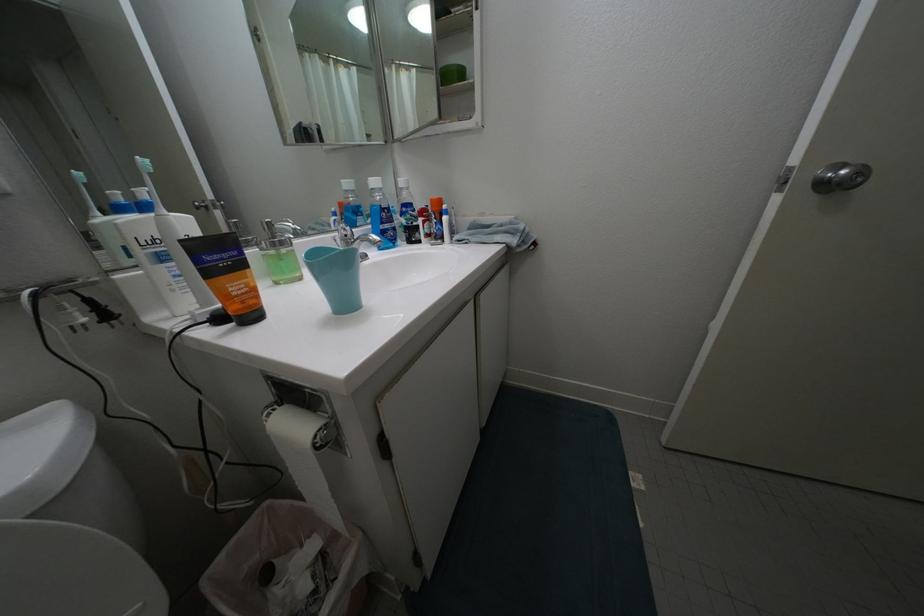
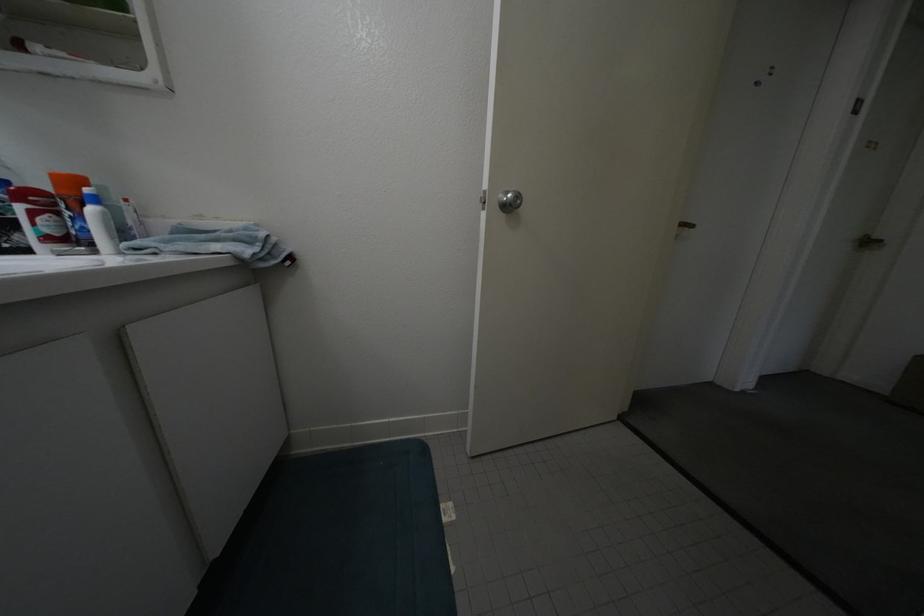
Question: The camera is either moving clockwise (left) or counter-clockwise (right) around the object. The first image is from the beginning of the video and the second image is from the end. Is the camera moving left or right when shooting the video?

Choices:
 (A) Left
 (B) Right

Answer: (A)